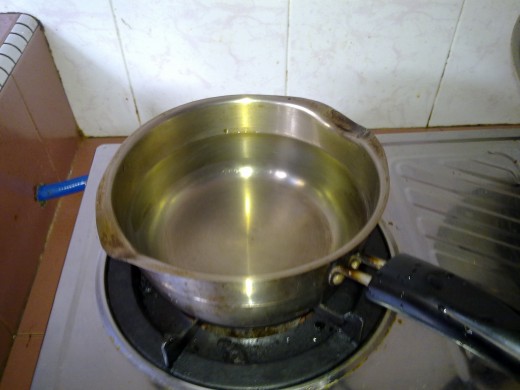
At what (x,y) coordinates should I click in order to perform the action: click on wall. Please return your answer as a coordinate pair (x, y). Looking at the image, I should click on (374, 21).